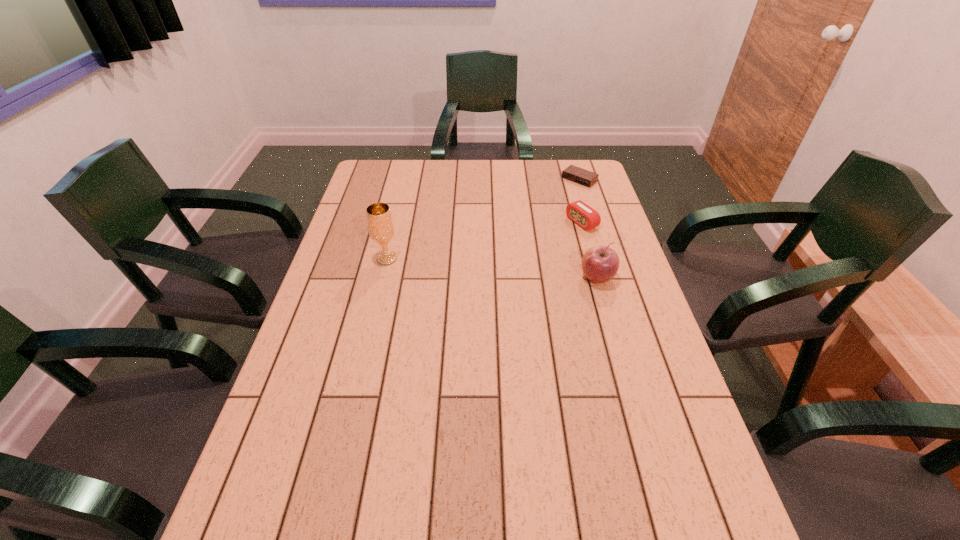
Locate an element on the screen. The image size is (960, 540). free space located 0.120m on the front-facing side of the taller alarm clock is located at coordinates (541, 241).

Identify the location of free space located on the front-facing side of the taller alarm clock. (486, 265).

The width and height of the screenshot is (960, 540). I want to click on blank area located on the front face of the farther alarm clock, so click(564, 192).

Where is `blank space located 0.050m on the front face of the farther alarm clock`? The image size is (960, 540). blank space located 0.050m on the front face of the farther alarm clock is located at coordinates 564,192.

Locate an element on the screen. The width and height of the screenshot is (960, 540). vacant space located 0.160m on the front face of the farther alarm clock is located at coordinates click(x=547, y=205).

Find the location of a particular element. Image resolution: width=960 pixels, height=540 pixels. object situated at the far edge is located at coordinates (572, 173).

At what (x,y) coordinates should I click in order to perform the action: click on object that is at the left edge. Please return your answer as a coordinate pair (x, y). This screenshot has height=540, width=960. Looking at the image, I should click on (380, 225).

Locate an element on the screen. Image resolution: width=960 pixels, height=540 pixels. apple situated at the right edge is located at coordinates (600, 263).

Where is `object situated at the far right corner`? Image resolution: width=960 pixels, height=540 pixels. object situated at the far right corner is located at coordinates (572, 173).

Locate an element on the screen. free point at the far edge is located at coordinates (414, 163).